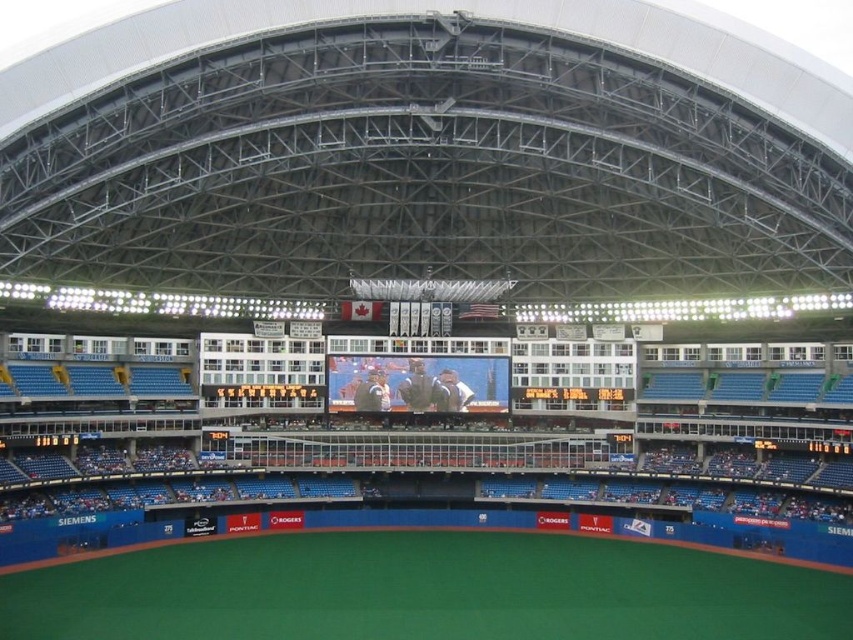
Question: Is matte digital screen at center to the left of black glossy scoreboard at center from the viewer's perspective?

Choices:
 (A) yes
 (B) no

Answer: (B)

Question: Is matte digital screen at center below black glossy scoreboard at center?

Choices:
 (A) yes
 (B) no

Answer: (B)

Question: Which point is farther to the camera?

Choices:
 (A) (306, 388)
 (B) (352, 376)

Answer: (A)

Question: Can you confirm if matte digital screen at center is wider than black glossy scoreboard at center?

Choices:
 (A) no
 (B) yes

Answer: (B)

Question: Which point is closer to the camera?

Choices:
 (A) (292, 387)
 (B) (453, 376)

Answer: (A)

Question: Which point is closer to the camera?

Choices:
 (A) matte digital screen at center
 (B) black glossy scoreboard at center

Answer: (B)